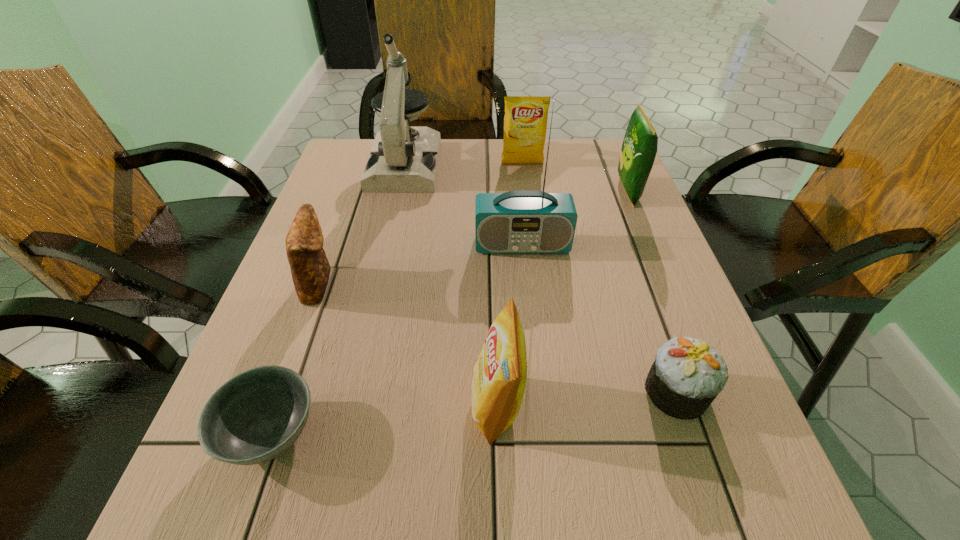
Identify the location of free space between the fourth farthest object and the microscope. This screenshot has width=960, height=540. (464, 205).

The image size is (960, 540). In order to click on unoccupied position between the farthest crisp (potato chip) and the microscope in this screenshot , I will do `click(464, 164)`.

At what (x,y) coordinates should I click in order to perform the action: click on blank region between the second nearest crisp (potato chip) and the sixth tallest object. Please return your answer as a coordinate pair (x, y). The image size is (960, 540). Looking at the image, I should click on (473, 238).

You are a GUI agent. You are given a task and a screenshot of the screen. Output one action in this format:
    pyautogui.click(x=<x>, y=<y>)
    Task: Click on the free spot between the nearest crisp (potato chip) and the cupcake
    The width and height of the screenshot is (960, 540).
    Given the screenshot: What is the action you would take?
    pos(587,398)

Locate an element on the screen. The image size is (960, 540). vacant point located between the nearest crisp (potato chip) and the fifth farthest object is located at coordinates pos(408,344).

Find the location of `object that is the second nearest to the second shortest object`. object that is the second nearest to the second shortest object is located at coordinates [x=525, y=221].

Identify the location of object that is the closest to the cupcake. The image size is (960, 540). (499, 376).

Select which crisp (potato chip) appears as the third closest to the radio receiver. Please provide its 2D coordinates. Your answer should be formatted as a tuple, i.e. [(x, y)], where the tuple contains the x and y coordinates of a point satisfying the conditions above.

[(499, 376)]

Identify which crisp (potato chip) is located as the second nearest to the clutch bag. Please provide its 2D coordinates. Your answer should be formatted as a tuple, i.e. [(x, y)], where the tuple contains the x and y coordinates of a point satisfying the conditions above.

[(525, 122)]

Find the location of a particular element. The height and width of the screenshot is (540, 960). free location that satisfies the following two spatial constraints: 1. on the open side of the second shortest object; 2. on the left side of the clutch bag is located at coordinates (280, 392).